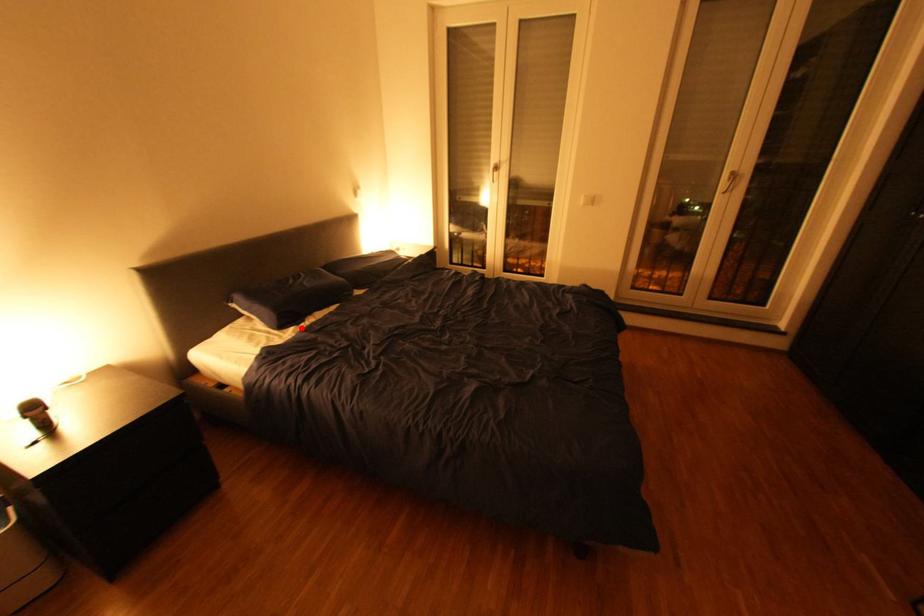
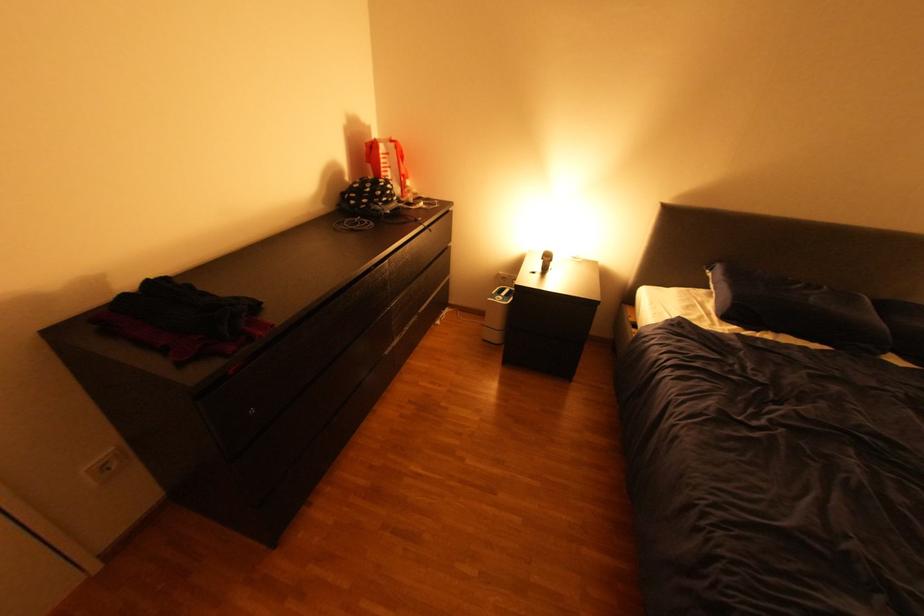
The point at the highlighted location is marked in the first image. Where is the corresponding point in the second image?

(745, 326)